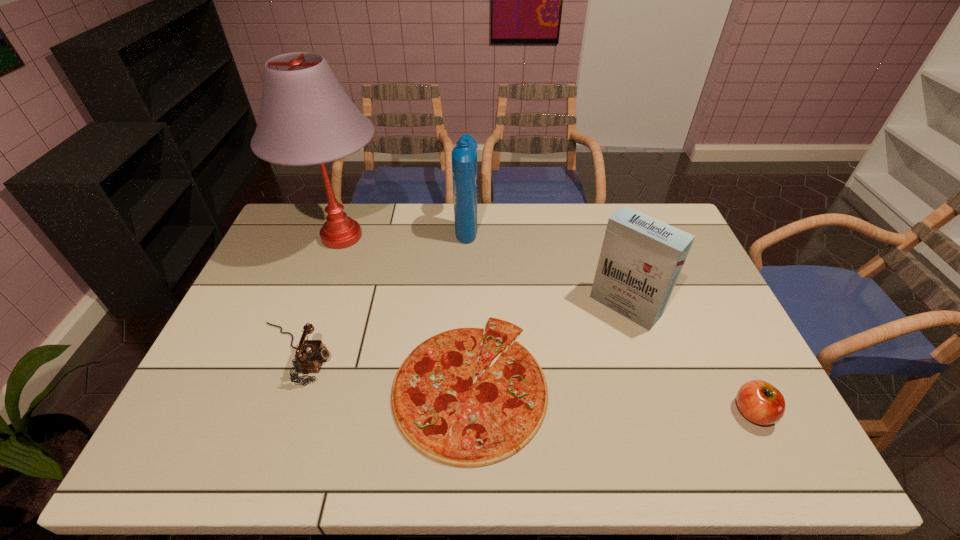
The image size is (960, 540). I want to click on free space between the rightmost object and the shortest object, so tap(612, 398).

The width and height of the screenshot is (960, 540). What are the coordinates of `free spot between the telephone and the second tallest object` in the screenshot? It's located at (380, 290).

The image size is (960, 540). Identify the location of vacant area between the apple and the tallest object. (547, 325).

Locate an element on the screen. The image size is (960, 540). vacant space that's between the fifth object from left to right and the table lamp is located at coordinates (484, 272).

At what (x,y) coordinates should I click in order to perform the action: click on free point between the second tallest object and the rightmost object. Please return your answer as a coordinate pair (x, y). The height and width of the screenshot is (540, 960). Looking at the image, I should click on (610, 319).

The image size is (960, 540). I want to click on empty space that is in between the second tallest object and the telephone, so click(x=380, y=290).

What are the coordinates of `vacant area that lies between the table lamp and the rightmost object` in the screenshot? It's located at (547, 325).

At what (x,y) coordinates should I click in order to perform the action: click on unoccupied position between the shampoo and the telephone. Please return your answer as a coordinate pair (x, y). The image size is (960, 540). Looking at the image, I should click on (380, 290).

Image resolution: width=960 pixels, height=540 pixels. I want to click on free spot between the fifth object from left to right and the shampoo, so click(546, 266).

Point out which object is positioned as the second nearest to the telephone. Please provide its 2D coordinates. Your answer should be formatted as a tuple, i.e. [(x, y)], where the tuple contains the x and y coordinates of a point satisfying the conditions above.

[(306, 118)]